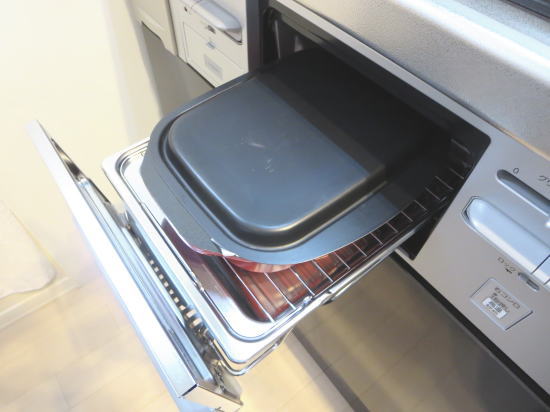
Identify the location of oven door. Image resolution: width=550 pixels, height=412 pixels. (136, 291).